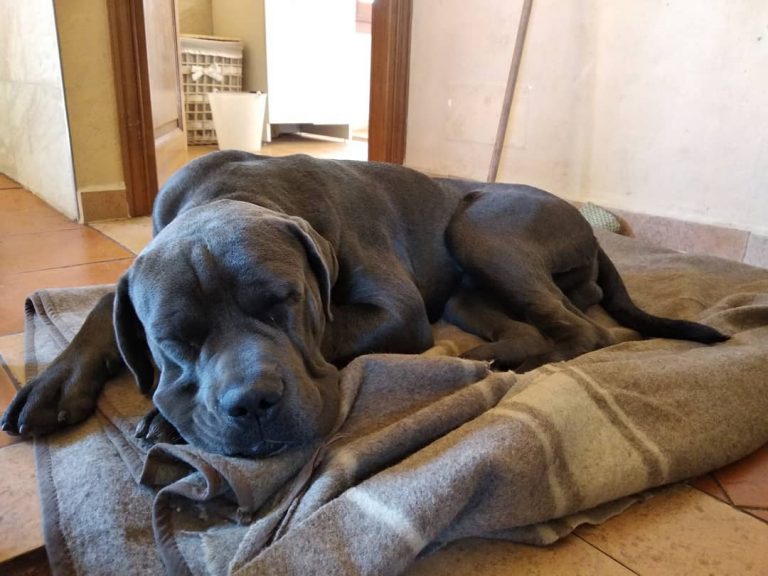
Identify the location of blanket. (674, 396).